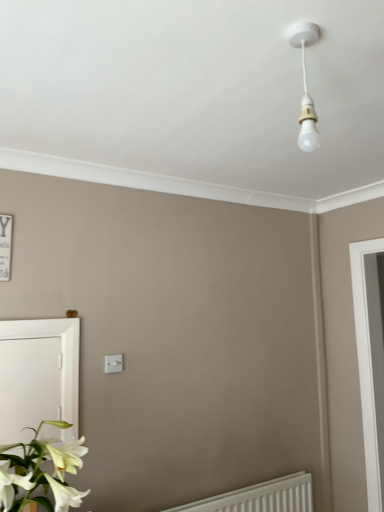
Question: Does white plastic light switch at center appear on the right side of white glossy screen door at lower left?

Choices:
 (A) yes
 (B) no

Answer: (A)

Question: Can you confirm if white plastic light switch at center is positioned to the left of white glossy screen door at lower left?

Choices:
 (A) no
 (B) yes

Answer: (A)

Question: Can you confirm if white plastic light switch at center is wider than white glossy screen door at lower left?

Choices:
 (A) yes
 (B) no

Answer: (B)

Question: Can you confirm if white plastic light switch at center is thinner than white glossy screen door at lower left?

Choices:
 (A) yes
 (B) no

Answer: (A)

Question: Is white plastic light switch at center oriented towards white glossy screen door at lower left?

Choices:
 (A) yes
 (B) no

Answer: (B)

Question: From a real-world perspective, is white plastic light switch at center located higher than white glossy screen door at lower left?

Choices:
 (A) yes
 (B) no

Answer: (A)

Question: From the image's perspective, is white plastic radiator at lower right below white glossy flower at lower left?

Choices:
 (A) no
 (B) yes

Answer: (B)

Question: Is white plastic radiator at lower right at the left side of white glossy flower at lower left?

Choices:
 (A) no
 (B) yes

Answer: (A)

Question: Does white plastic radiator at lower right have a lesser width compared to white glossy flower at lower left?

Choices:
 (A) no
 (B) yes

Answer: (B)

Question: Is white plastic radiator at lower right shorter than white glossy flower at lower left?

Choices:
 (A) no
 (B) yes

Answer: (B)

Question: Is white plastic radiator at lower right taller than white glossy flower at lower left?

Choices:
 (A) yes
 (B) no

Answer: (B)

Question: Are white plastic radiator at lower right and white glossy flower at lower left located far from each other?

Choices:
 (A) no
 (B) yes

Answer: (B)

Question: Would you consider white glossy screen door at lower left to be distant from white glossy flower at lower left?

Choices:
 (A) yes
 (B) no

Answer: (B)